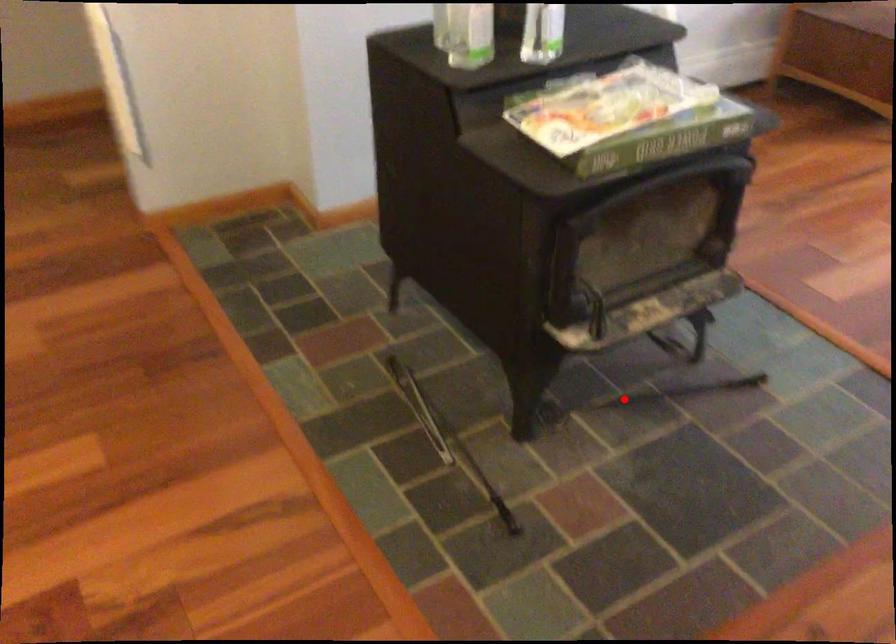
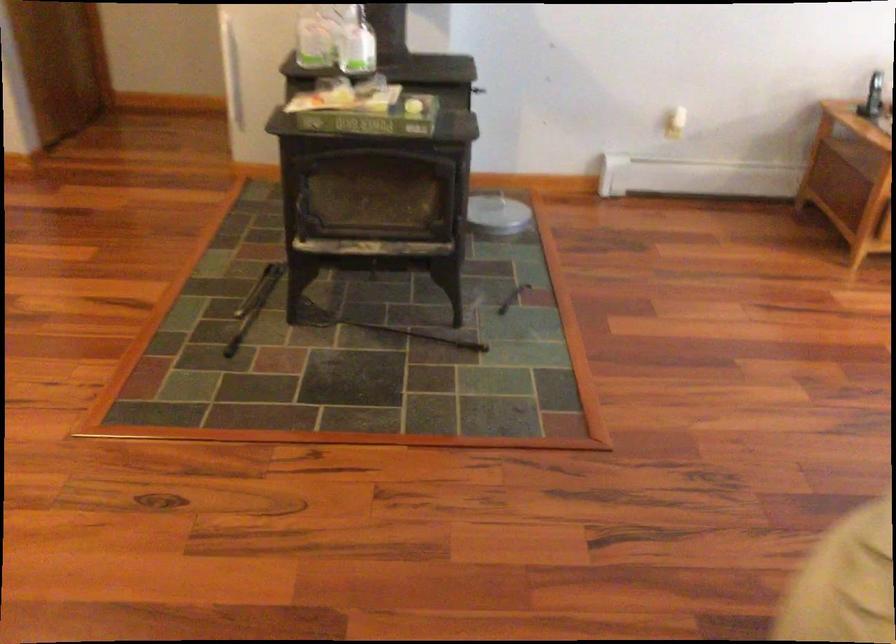
In the second image, find the point that corresponds to the highlighted location in the first image.

(380, 327)